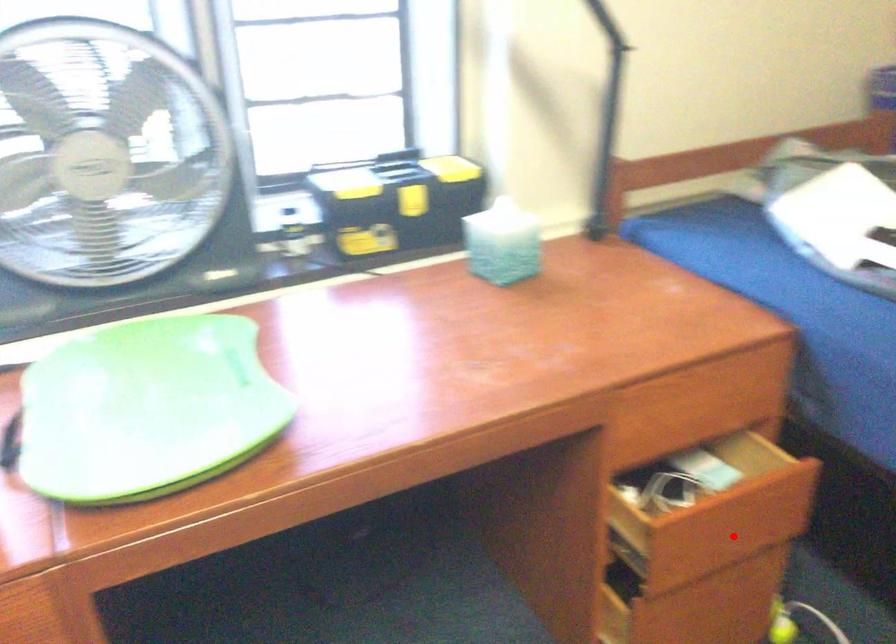
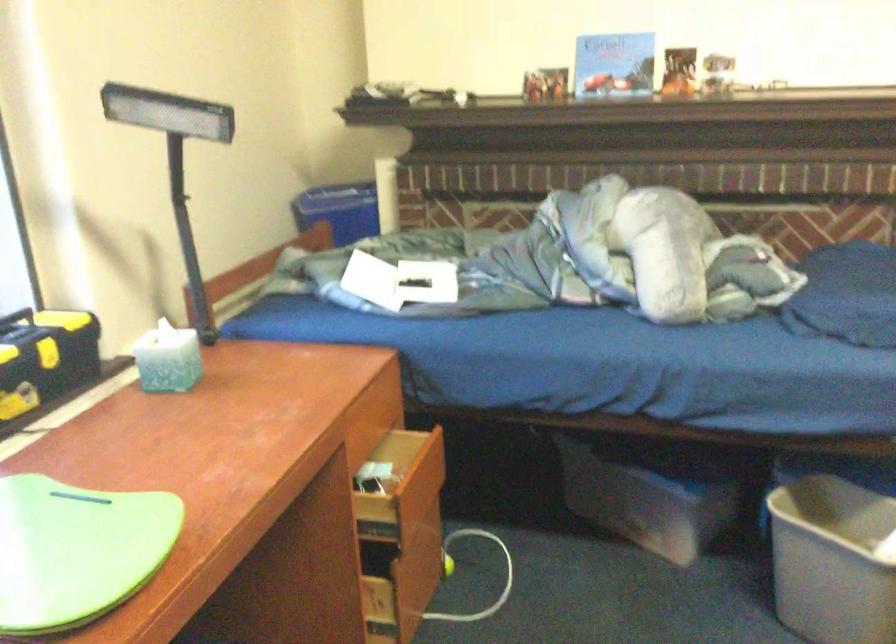
Locate, in the second image, the point that corresponds to the highlighted location in the first image.

(419, 489)